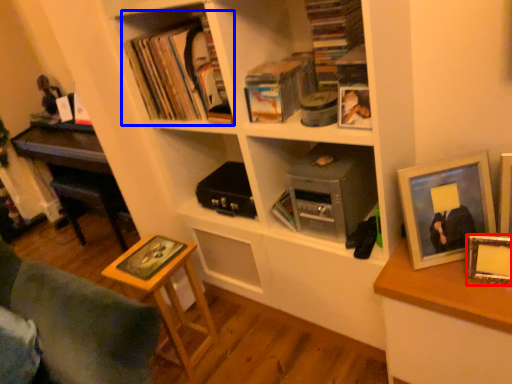
Question: Which object appears farthest to the camera in this image, picture frame (highlighted by a red box) or book (highlighted by a blue box)?

Choices:
 (A) picture frame
 (B) book

Answer: (B)